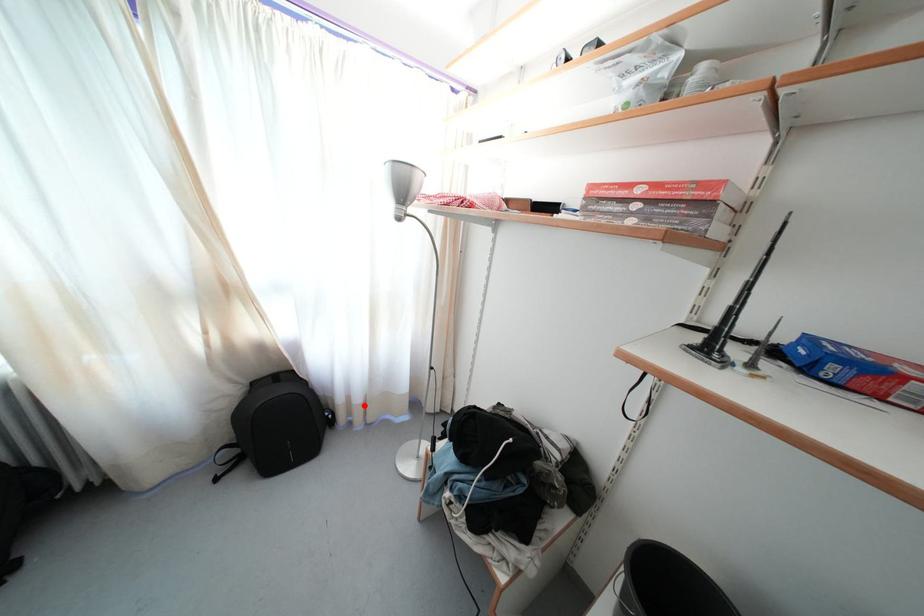
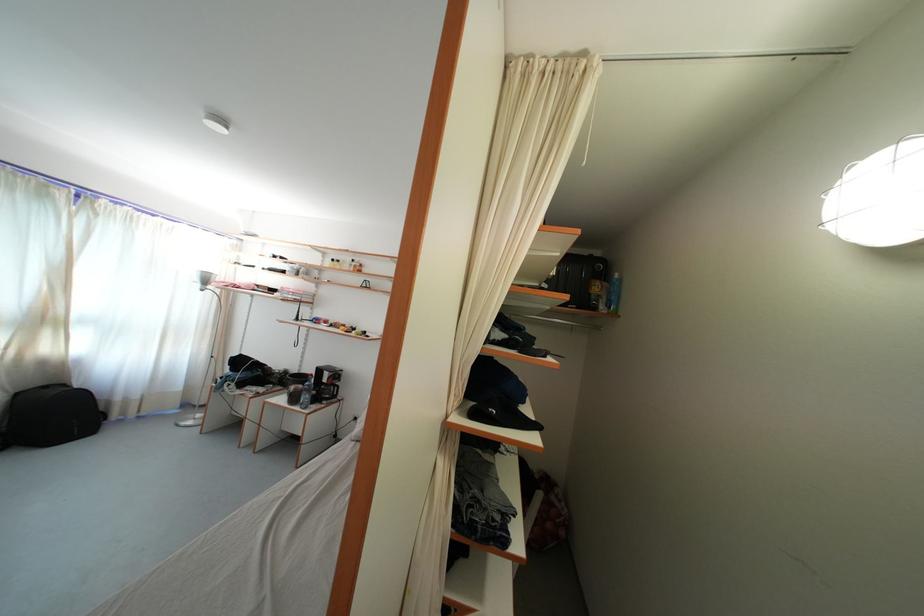
Question: A red point is marked in image1. In image2, is the corresponding 3D point closer to the camera or farther? Reply with the corresponding letter.

Choices:
 (A) The corresponding 3D point is closer.
 (B) The corresponding 3D point is farther.

Answer: (A)